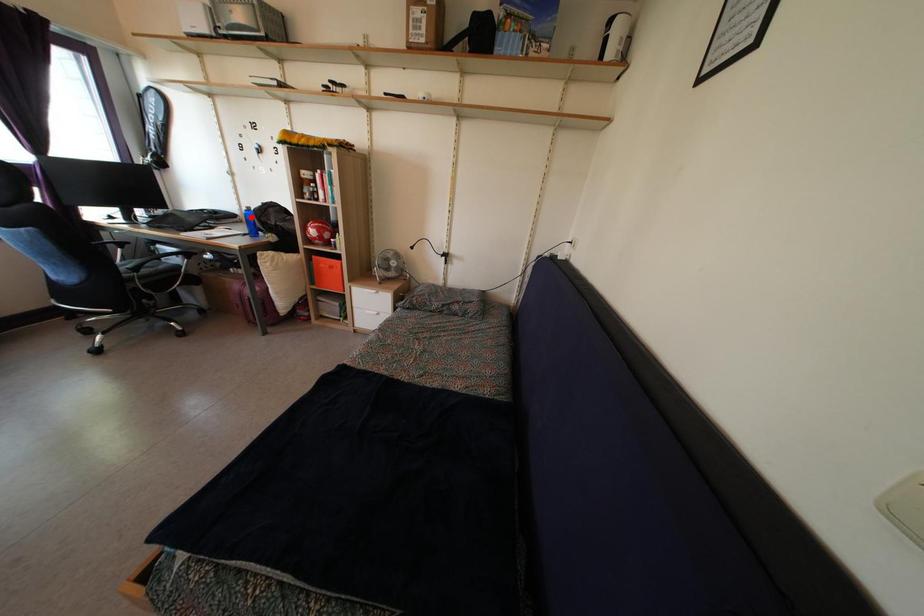
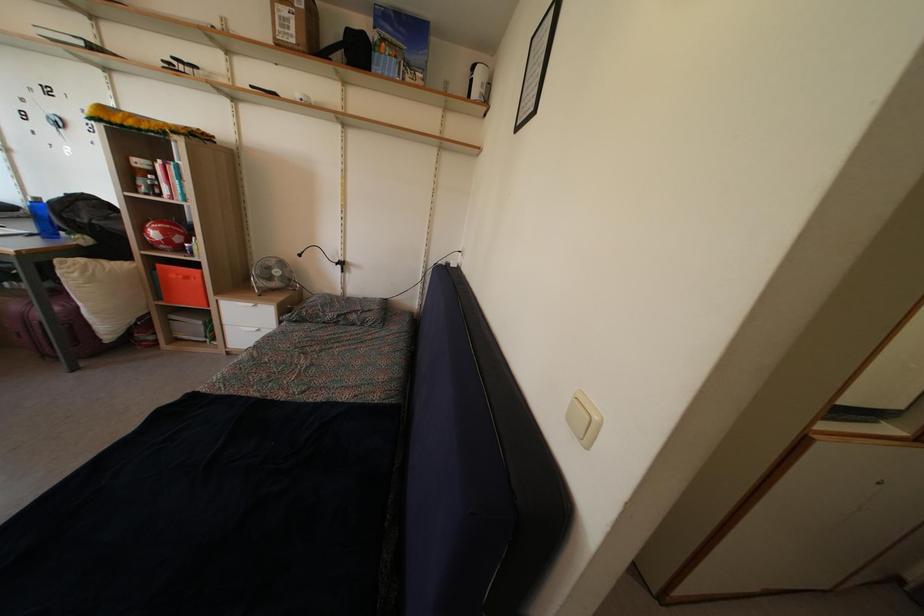
In the second image, find the point that corresponds to the highlighted location in the first image.

(40, 208)